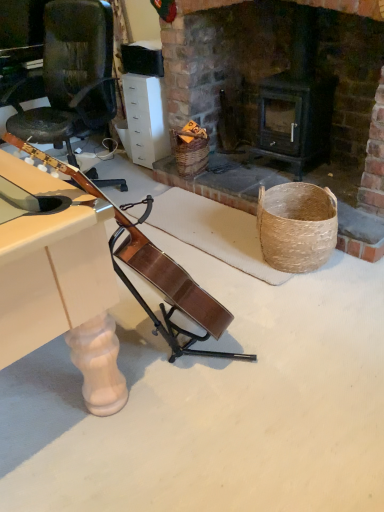
Question: Based on their positions, is white glossy drawer at upper center located to the left or right of woven brown basket at center?

Choices:
 (A) left
 (B) right

Answer: (A)

Question: Looking at the image, does white glossy drawer at upper center seem bigger or smaller compared to woven brown basket at center?

Choices:
 (A) small
 (B) big

Answer: (B)

Question: Considering the positions of point (147, 129) and point (198, 140), is point (147, 129) closer or farther from the camera than point (198, 140)?

Choices:
 (A) farther
 (B) closer

Answer: (A)

Question: Based on their sizes in the image, would you say woven brown basket at center is bigger or smaller than white glossy drawer at upper center?

Choices:
 (A) big
 (B) small

Answer: (B)

Question: Does point (177, 148) appear closer or farther from the camera than point (165, 132)?

Choices:
 (A) closer
 (B) farther

Answer: (A)

Question: In terms of width, does woven brown basket at center look wider or thinner when compared to white glossy drawer at upper center?

Choices:
 (A) thin
 (B) wide

Answer: (A)

Question: Would you say woven brown basket at center is to the left or to the right of white glossy drawer at upper center in the picture?

Choices:
 (A) left
 (B) right

Answer: (B)